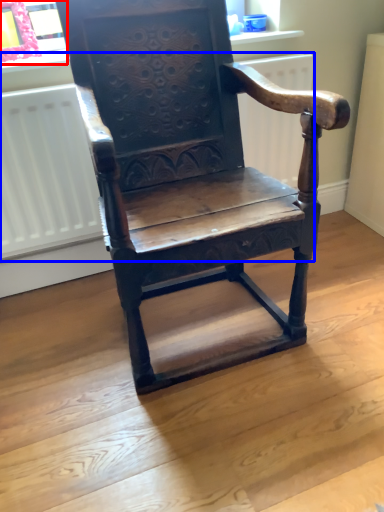
Question: Among these objects, which one is farthest to the camera, window frame (highlighted by a red box) or radiator (highlighted by a blue box)?

Choices:
 (A) window frame
 (B) radiator

Answer: (A)